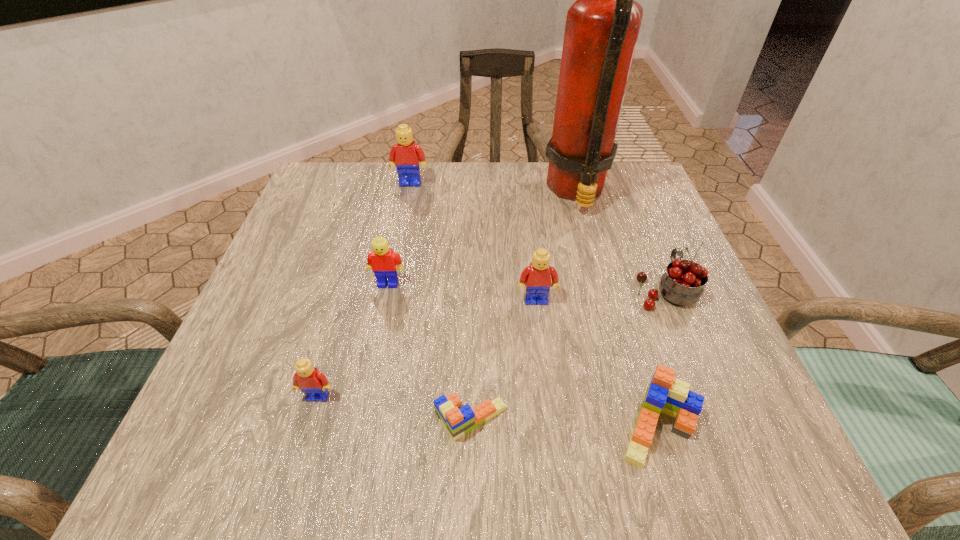
This screenshot has width=960, height=540. Identify the location of object that can be found as the seventh closest to the second shortest object. pyautogui.click(x=405, y=155).

Identify which object is located as the seventh nearest to the fifth Lego from left to right. Please provide its 2D coordinates. Your answer should be formatted as a tuple, i.e. [(x, y)], where the tuple contains the x and y coordinates of a point satisfying the conditions above.

[(405, 155)]

Locate which Lego ranks in proximity to the red cherry. Please provide its 2D coordinates. Your answer should be formatted as a tuple, i.e. [(x, y)], where the tuple contains the x and y coordinates of a point satisfying the conditions above.

[(536, 278)]

Where is `Lego that is the third closest to the rightmost yellow Lego`? The width and height of the screenshot is (960, 540). Lego that is the third closest to the rightmost yellow Lego is located at coordinates (382, 260).

Select which yellow Lego is the closest to the cherry. Please provide its 2D coordinates. Your answer should be formatted as a tuple, i.e. [(x, y)], where the tuple contains the x and y coordinates of a point satisfying the conditions above.

[(536, 278)]

You are a GUI agent. You are given a task and a screenshot of the screen. Output one action in this format:
    pyautogui.click(x=<x>, y=<y>)
    Task: Click on the yellow Lego object that ranks as the second closest to the farthest yellow Lego
    The width and height of the screenshot is (960, 540).
    Given the screenshot: What is the action you would take?
    pyautogui.click(x=536, y=278)

At what (x,y) coordinates should I click in order to perform the action: click on free space that satisfies the following two spatial constraints: 1. on the front-facing side of the shortest object; 2. on the right side of the third nearest yellow Lego. Please return your answer as a coordinate pair (x, y). Looking at the image, I should click on (360, 420).

This screenshot has width=960, height=540. I want to click on vacant position in the image that satisfies the following two spatial constraints: 1. on the front-facing side of the third nearest yellow Lego; 2. on the right side of the seventh tallest object, so click(x=358, y=428).

You are a GUI agent. You are given a task and a screenshot of the screen. Output one action in this format:
    pyautogui.click(x=<x>, y=<y>)
    Task: Click on the vacant space that satisfies the following two spatial constraints: 1. at the nozzle of the tallest object; 2. on the front-facing side of the second farthest yellow Lego
    The height and width of the screenshot is (540, 960).
    Given the screenshot: What is the action you would take?
    pyautogui.click(x=602, y=284)

Locate an element on the screen. free location that satisfies the following two spatial constraints: 1. at the nozzle of the red fire extinguisher; 2. on the front-facing side of the third nearest yellow Lego is located at coordinates (602, 284).